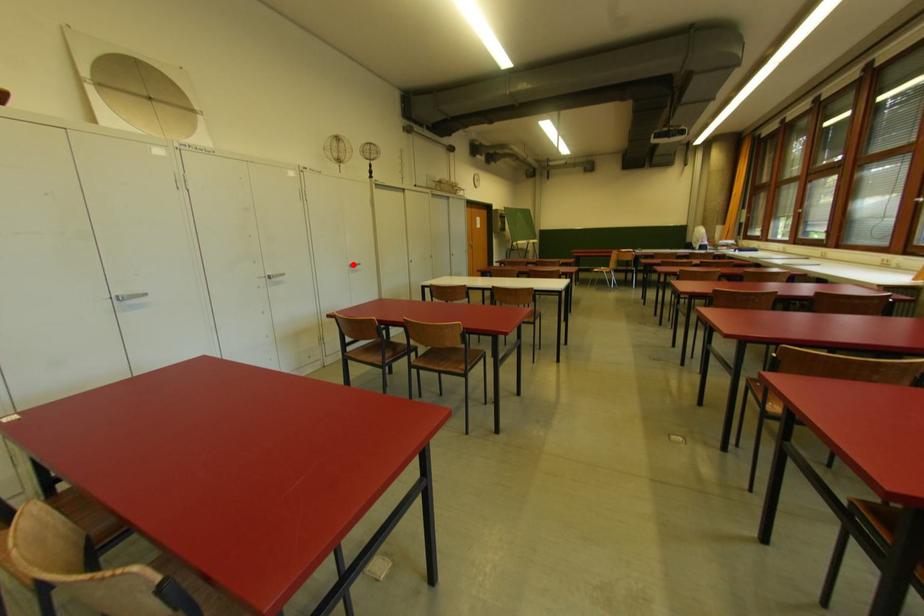
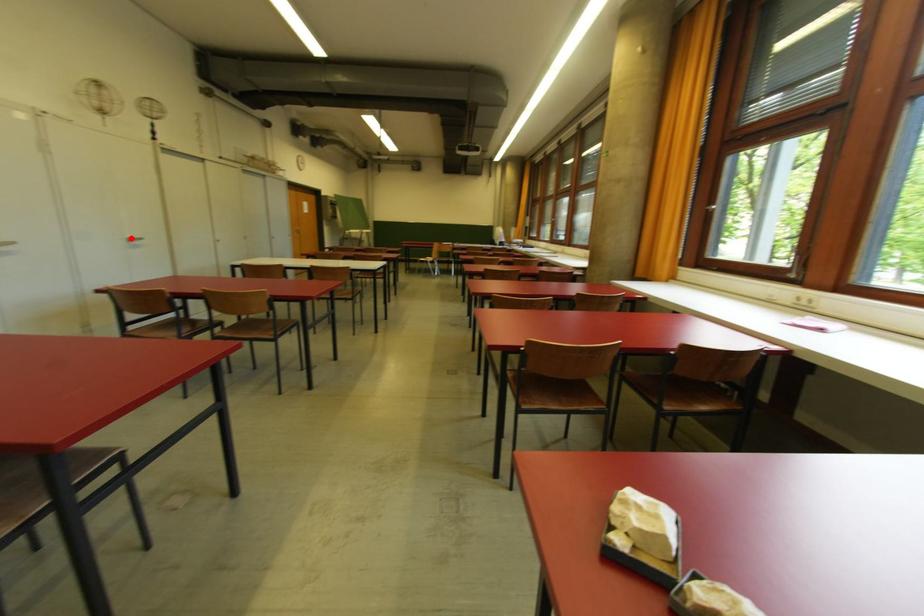
I am providing you with two images of the same scene from different viewpoints. A red point is marked on the first image and another point is marked on the second image. Is the marked point in image1 the same physical position as the marked point in image2?

Yes